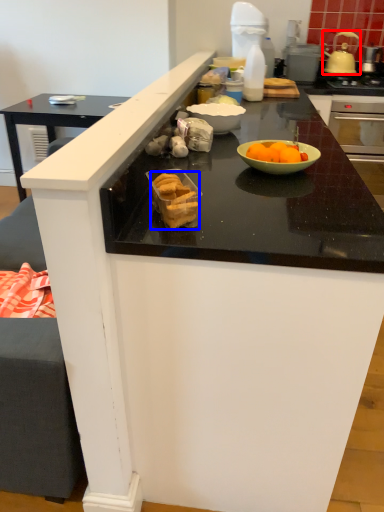
Question: Which of the following is the closest to the observer, kitchen appliance (highlighted by a red box) or food (highlighted by a blue box)?

Choices:
 (A) kitchen appliance
 (B) food

Answer: (B)